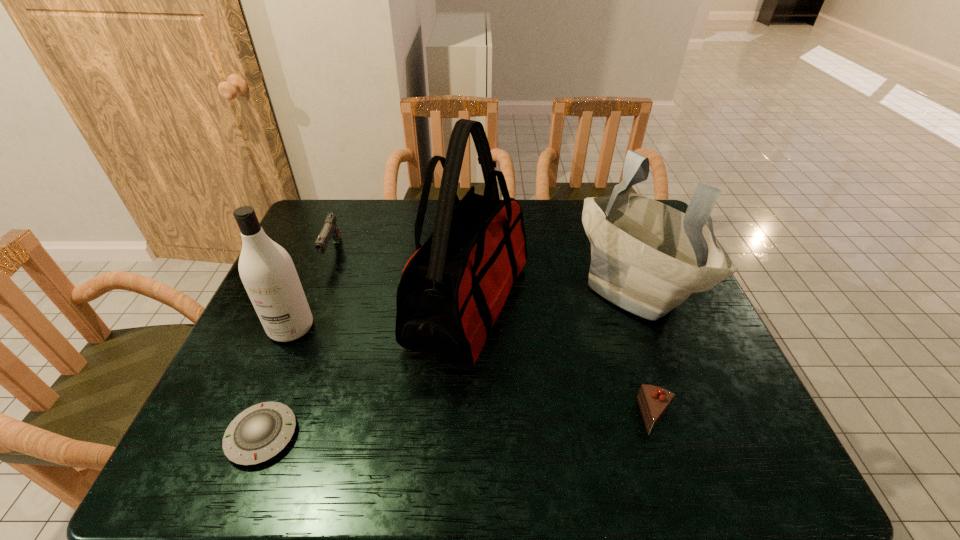
I want to click on object positioned at the near left corner, so click(x=260, y=432).

This screenshot has width=960, height=540. What are the coordinates of `vacant space at the far edge` in the screenshot? It's located at (368, 222).

In order to click on vacant space at the near edge of the desktop in this screenshot , I will do click(479, 454).

Find the location of a particular element. The image size is (960, 540). vacant point at the left edge is located at coordinates (212, 418).

I want to click on vacant space at the right edge of the desktop, so click(x=716, y=430).

Locate an element on the screen. The height and width of the screenshot is (540, 960). vacant space that's between the tallest object and the shopping bag is located at coordinates (552, 296).

The image size is (960, 540). What are the coordinates of `unoccupied position between the third shortest object and the shampoo` in the screenshot? It's located at (312, 290).

Where is `vacant space that is in between the saucer and the tallest object`? This screenshot has height=540, width=960. vacant space that is in between the saucer and the tallest object is located at coordinates (365, 370).

This screenshot has height=540, width=960. Identify the location of free space between the saucer and the fourth tallest object. (298, 344).

Where is `free spot between the chocolate cake and the tallest object`? free spot between the chocolate cake and the tallest object is located at coordinates (563, 360).